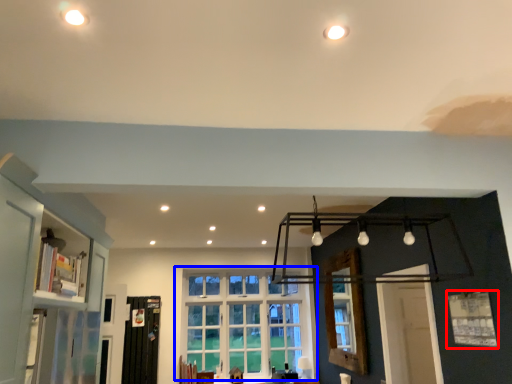
Question: Which object is further to the camera taking this photo, window (highlighted by a red box) or window (highlighted by a blue box)?

Choices:
 (A) window
 (B) window

Answer: (B)